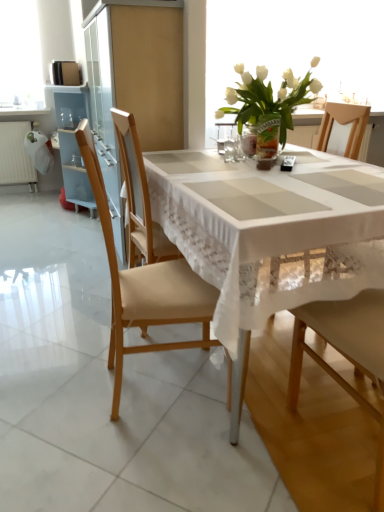
Where is `free space that is to the left of clear glass vase at center, the second tableware viewed from the left`? This screenshot has height=512, width=384. free space that is to the left of clear glass vase at center, the second tableware viewed from the left is located at coordinates (202, 158).